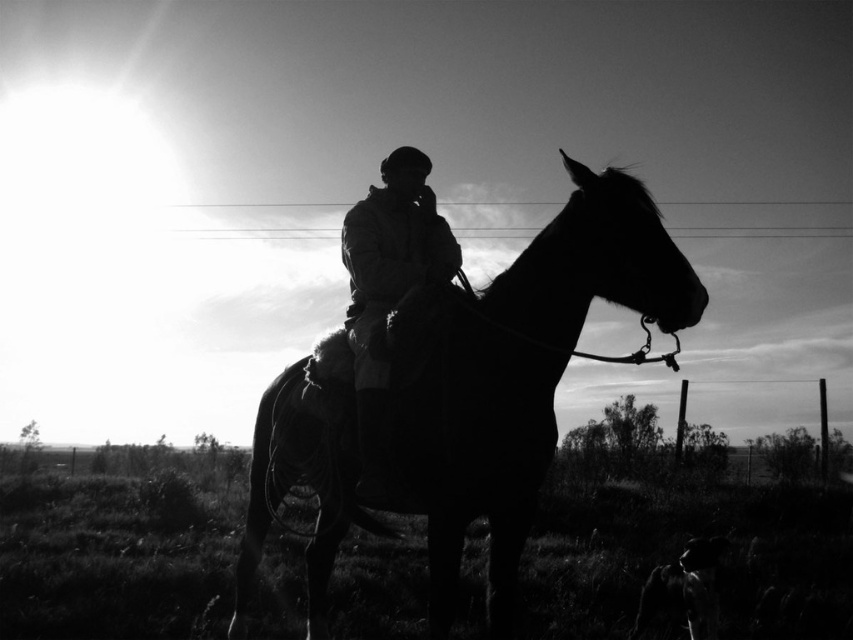
Can you confirm if silhouette glossy horse at center is positioned below silhouette leather jacket at center?

Indeed, silhouette glossy horse at center is positioned under silhouette leather jacket at center.

Is point (489, 506) behind point (419, 273)?

No, it is not.

Is point (322, 586) positioned after point (369, 289)?

Yes, it is behind point (369, 289).

Where is `silhouette glossy horse at center`? silhouette glossy horse at center is located at coordinates (515, 374).